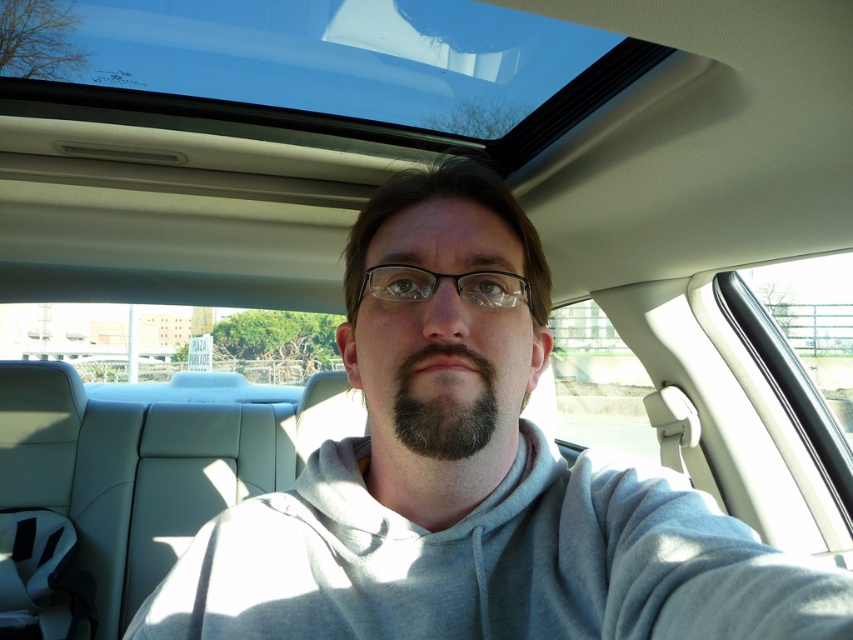
You are a photographer trying to capture a clear shot of the driver. The dark brown fuzzy beard at center and the black plastic glasses at center are both in the frame. Which object should you focus on to ensure the glasses are in sharp focus?

The dark brown fuzzy beard at center is in front of the black plastic glasses at center, so focusing on the beard will ensure the glasses are also in focus since they are behind it.

You are sitting in the driver seat of the car and want to check if the transparent glass sunroof at upper center is taller than the dark brown fuzzy beard at center. Can you confirm this?

The transparent glass sunroof at upper center is taller than the dark brown fuzzy beard at center according to the description.

You are sitting in the driver seat of a car with a sunroof. You notice a point at coordinate point (326, 67). What object in the car corresponds to this coordinate?

The transparent glass sunroof at upper center corresponds to the coordinate point (326, 67).